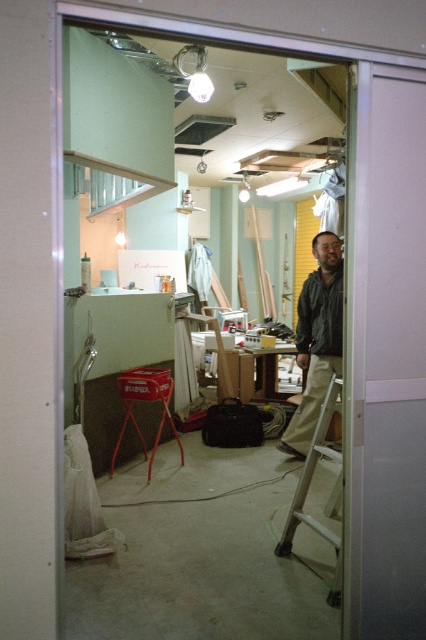
Which is behind, point (227, 499) or point (319, 396)?

The point (319, 396) is behind.

How distant is transparent glass door at center from dark green jacket at center?

The distance of transparent glass door at center from dark green jacket at center is 5.16 meters.

Who is more forward, (340,330) or (327,337)?

Point (327,337) is more forward.

Where is `transparent glass door at center`? Image resolution: width=426 pixels, height=640 pixels. transparent glass door at center is located at coordinates (192, 337).

Between transparent glass door at center and metallic silver ladder at center, which one has more height?

With more height is metallic silver ladder at center.

Is point (132, 611) closer to viewer compared to point (310, 477)?

Yes, it is.

Find the location of a particular element. transparent glass door at center is located at coordinates (192, 337).

Is point (339, 355) more distant than point (337, 545)?

Yes, point (339, 355) is behind point (337, 545).

Locate an element on the screen. dark green jacket at center is located at coordinates (316, 339).

Find the location of a particular element. This screenshot has width=426, height=640. dark green jacket at center is located at coordinates (316, 339).